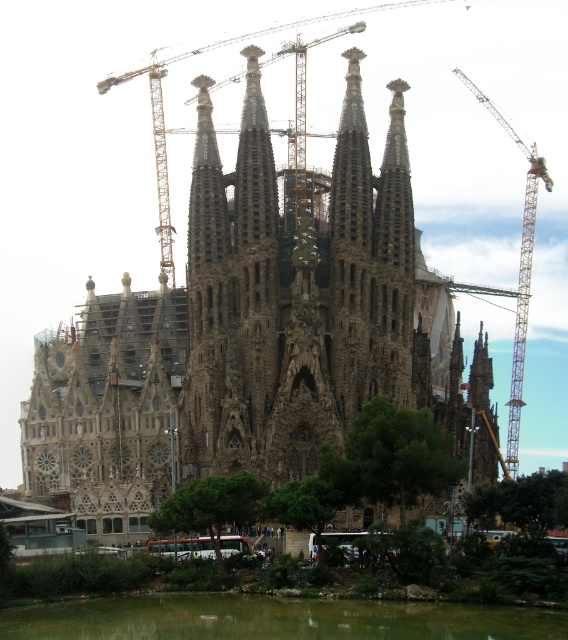
You are standing at the Sagrada Familia and want to take a photo of the yellow metallic crane at upper right. To avoid including the green liquid water at lower center in your shot, should you move left or right?

Since the green liquid water at lower center is to the left of the yellow metallic crane at upper right, you should move to the right to avoid including it in your photo.

You are a tourist visiting Sagrada Familia and you see the green liquid water at lower center and the metallic construction crane at upper center in the image. Which object appears taller in the image?

The metallic construction crane at upper center appears taller than the green liquid water at lower center in the image.

You are a tourist standing at the Sagrada Familia, looking at the scene. You notice the green liquid water at lower center and the metallic construction crane at upper center. Which object takes up more horizontal space in the image?

The green liquid water at lower center takes up more horizontal space in the image because its width is larger than that of the metallic construction crane at upper center.